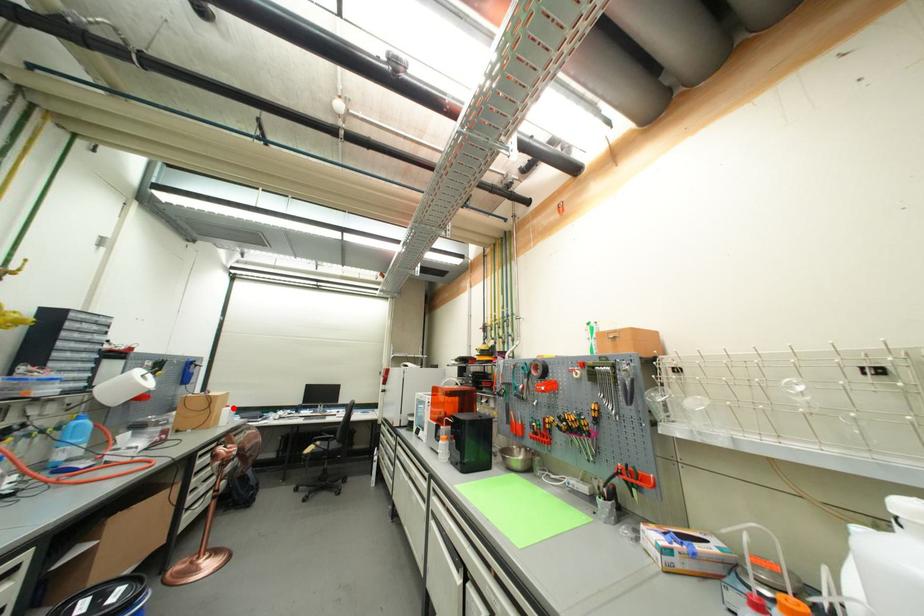
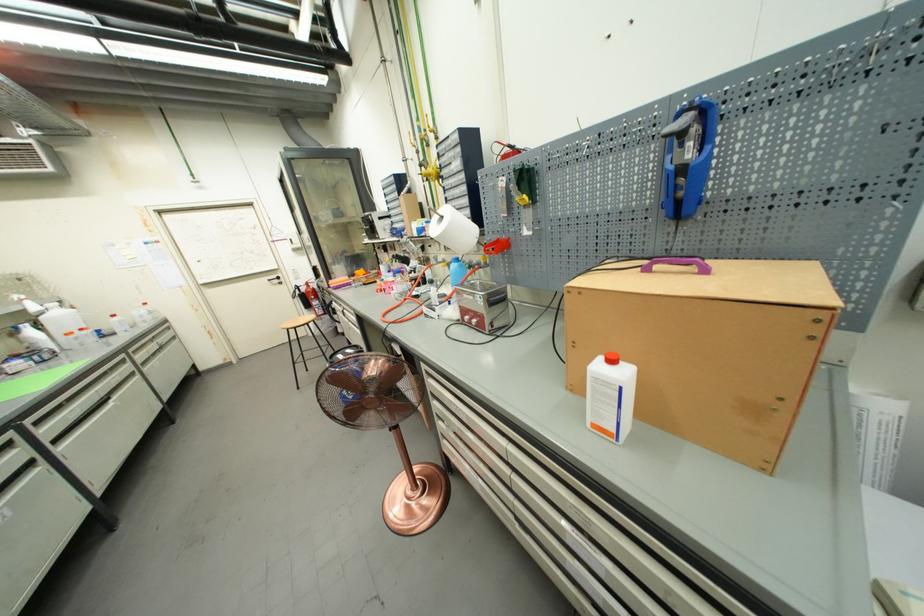
Question: I am providing you with two images of the same scene from different viewpoints. A red point is marked on the first image. Is the red point's position out of view in image 2?

Choices:
 (A) Yes
 (B) No

Answer: (B)